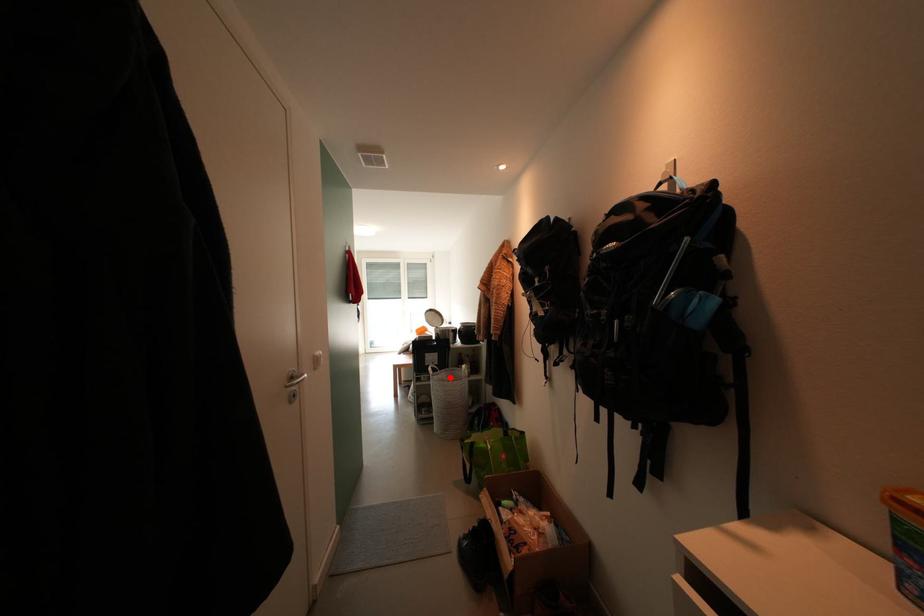
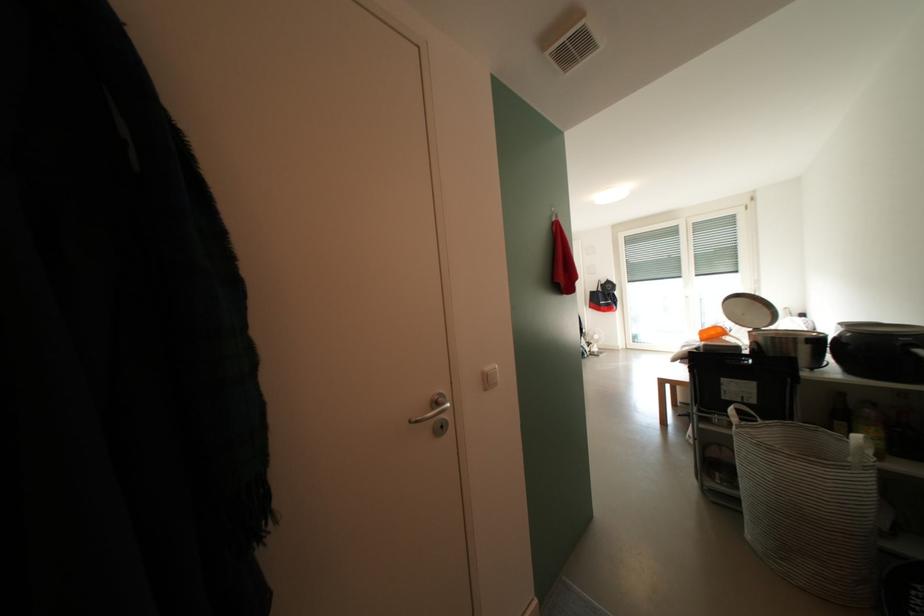
Question: I am providing you with two images of the same scene from different viewpoints. In image1, a red point is highlighted. Considering the same 3D point in image2, which of the following is correct?

Choices:
 (A) It is closer
 (B) It is farther

Answer: (A)